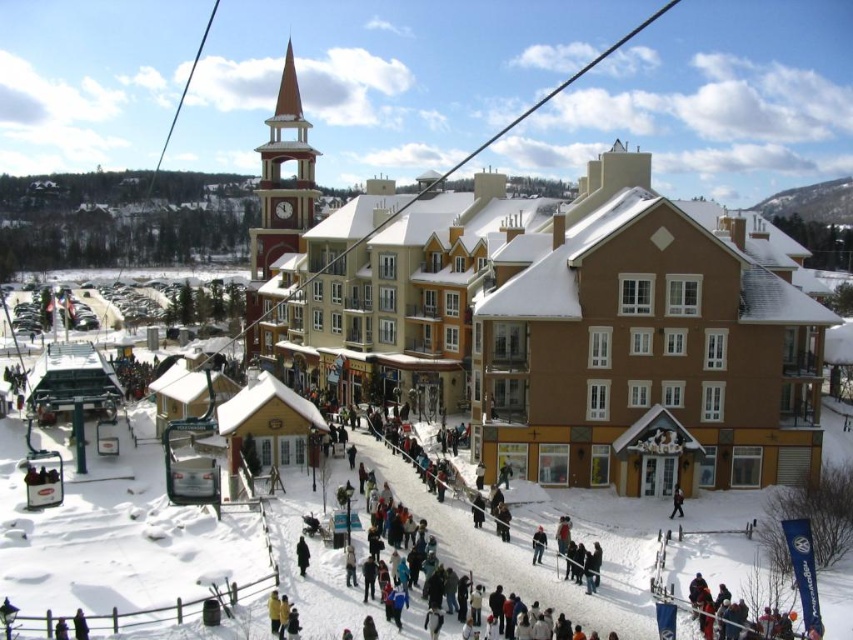
Question: Which object is farther from the camera taking this photo?

Choices:
 (A) brown wooden building at center
 (B) dark gray jacket at center

Answer: (A)

Question: Is brown wooden building at center wider than dark gray jacket at center?

Choices:
 (A) yes
 (B) no

Answer: (A)

Question: Among these objects, which one is farthest from the camera?

Choices:
 (A) black matte coat at lower center
 (B) dark gray jacket at center

Answer: (B)

Question: Which point is farther from the camera taking this photo?

Choices:
 (A) (682, 515)
 (B) (759, 413)
 (C) (300, 570)

Answer: (B)

Question: Is black matte coat at lower center positioned behind dark gray jacket at center?

Choices:
 (A) yes
 (B) no

Answer: (B)

Question: Does brown wooden building at center appear on the left side of black matte coat at lower center?

Choices:
 (A) no
 (B) yes

Answer: (A)